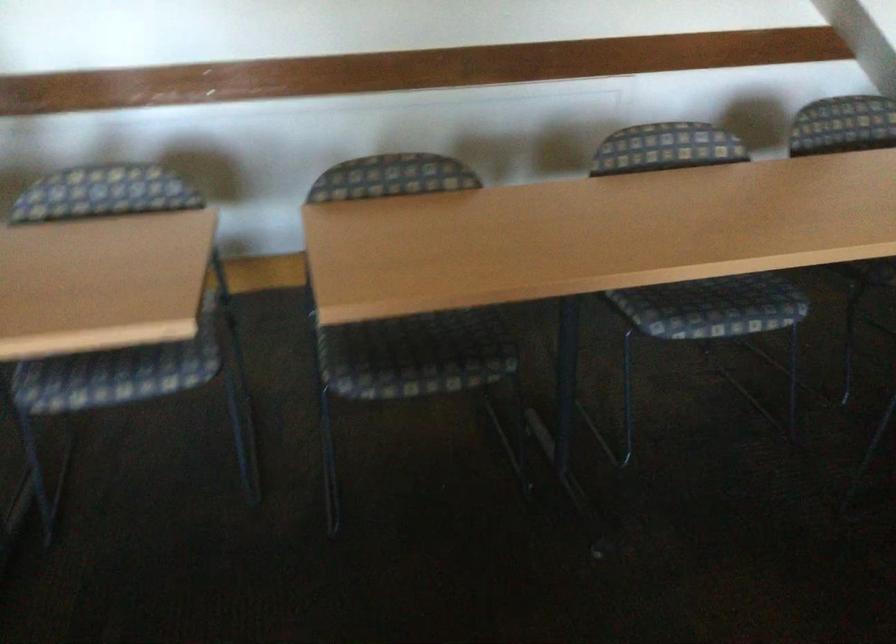
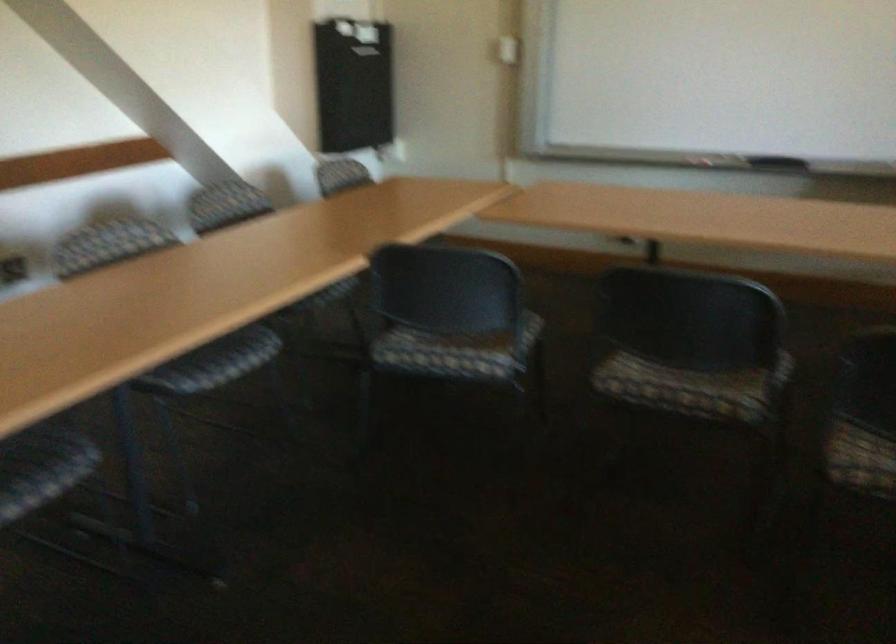
Locate, in the second image, the point that corresponds to point 709,319 in the first image.

(219, 366)